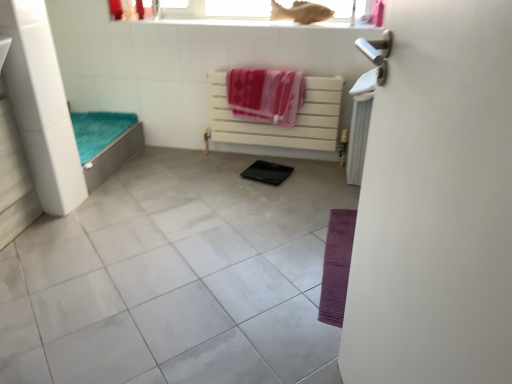
You are a GUI agent. You are given a task and a screenshot of the screen. Output one action in this format:
    pyautogui.click(x=<x>, y=<y>)
    Task: Click on the vacant area on top of white glossy tile at center (from a real-world perspective)
    The width and height of the screenshot is (512, 384).
    Given the screenshot: What is the action you would take?
    coord(209,253)